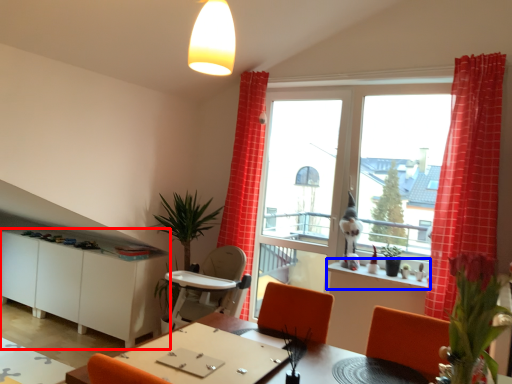
Question: Which object is closer to the camera taking this photo, cabinetry (highlighted by a red box) or window sill (highlighted by a blue box)?

Choices:
 (A) cabinetry
 (B) window sill

Answer: (B)